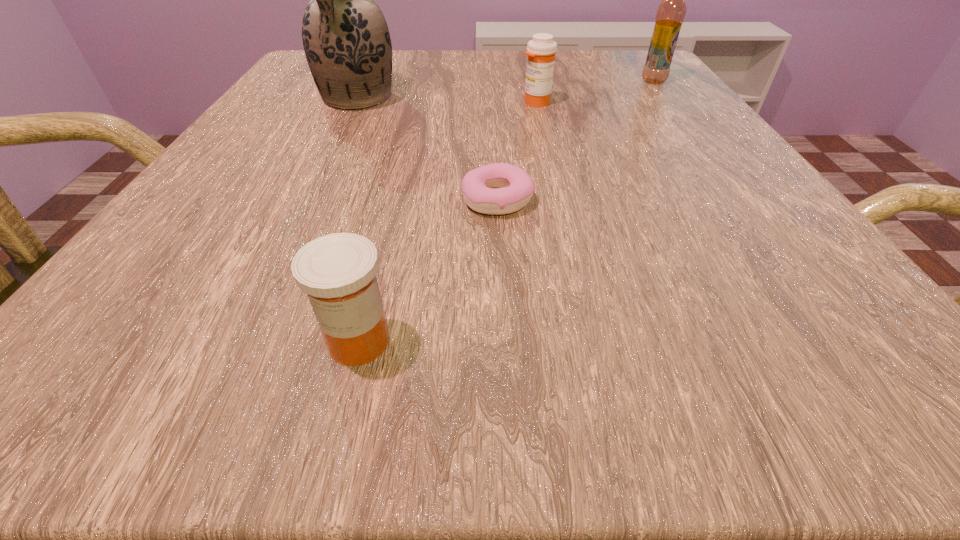
At what (x,y) coordinates should I click in order to perform the action: click on object that is at the far right corner. Please return your answer as a coordinate pair (x, y). The height and width of the screenshot is (540, 960). Looking at the image, I should click on pos(671,12).

Where is `vacant point at the far edge`? The width and height of the screenshot is (960, 540). vacant point at the far edge is located at coordinates (450, 75).

At what (x,y) coordinates should I click in order to perform the action: click on vacant space at the near edge. Please return your answer as a coordinate pair (x, y). The height and width of the screenshot is (540, 960). Looking at the image, I should click on (668, 321).

The image size is (960, 540). Find the location of `free space at the right edge of the desktop`. free space at the right edge of the desktop is located at coordinates (657, 99).

In the image, there is a desktop. Where is `vacant space at the near left corner`? This screenshot has height=540, width=960. vacant space at the near left corner is located at coordinates (64, 350).

Locate an element on the screen. Image resolution: width=960 pixels, height=540 pixels. free space at the far right corner of the desktop is located at coordinates (586, 68).

Find the location of a particular element. free space between the farther medicine and the third object from left to right is located at coordinates (516, 151).

This screenshot has width=960, height=540. Identify the location of free space between the nearer medicine and the third object from right to left. (428, 271).

What are the coordinates of `vacant space in between the second object from right to left and the bottle` in the screenshot? It's located at (594, 92).

At what (x,y) coordinates should I click in order to perform the action: click on free space between the tallest object and the second object from right to left. Please return your answer as a coordinate pair (x, y). The width and height of the screenshot is (960, 540). Looking at the image, I should click on (446, 101).